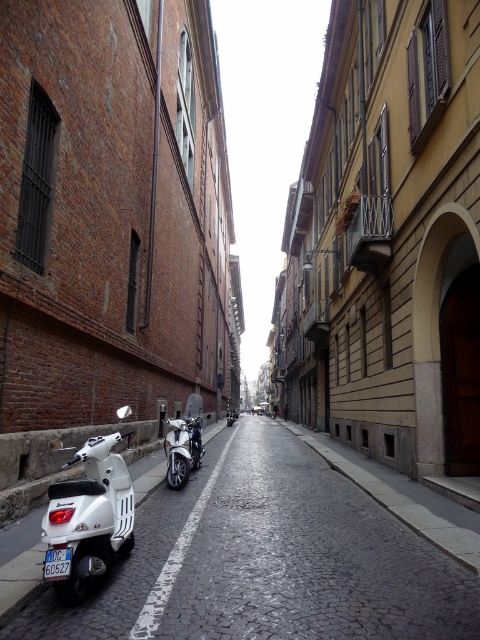
Question: Which is farther from the white matte scooter at lower left?

Choices:
 (A) white glossy scooter at lower left
 (B) shiny chrome motorcycle at center
 (C) white glossy scooter at left
 (D) blue plastic license plate at center

Answer: (B)

Question: Is white matte scooter at lower left bigger than shiny chrome motorcycle at center?

Choices:
 (A) no
 (B) yes

Answer: (B)

Question: Which object is closer to the camera taking this photo?

Choices:
 (A) white glossy scooter at left
 (B) white glossy scooter at lower left
 (C) shiny chrome motorcycle at center

Answer: (B)

Question: Is the position of white glossy scooter at lower left more distant than that of white glossy scooter at left?

Choices:
 (A) yes
 (B) no

Answer: (B)

Question: Estimate the real-world distances between objects in this image. Which object is farther from the white matte scooter at center?

Choices:
 (A) shiny chrome motorcycle at center
 (B) white matte scooter at lower left
 (C) white glossy scooter at lower left

Answer: (B)

Question: Does white glossy scooter at lower left come in front of white glossy scooter at left?

Choices:
 (A) no
 (B) yes

Answer: (B)